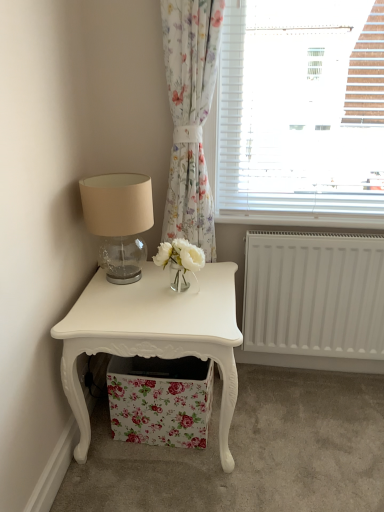
In order to click on vacant area that lies in front of floral fabric storage box at lower center in this screenshot , I will do `click(163, 475)`.